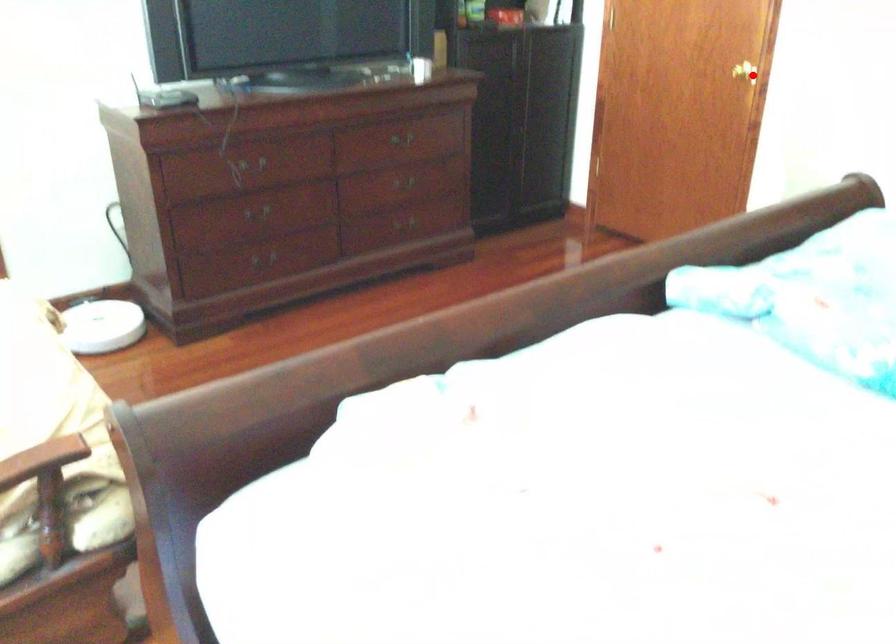
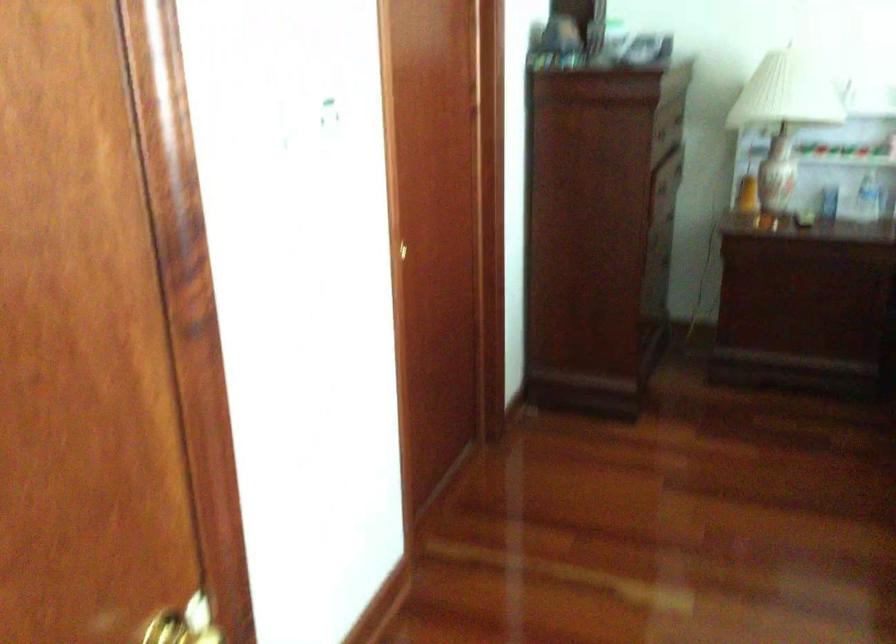
Question: I am providing you with two images of the same scene from different viewpoints. Image1 has a red point marked. In image2, the corresponding 3D location appears at what relative position? Reply with the corresponding letter.

Choices:
 (A) Closer
 (B) Farther

Answer: (A)